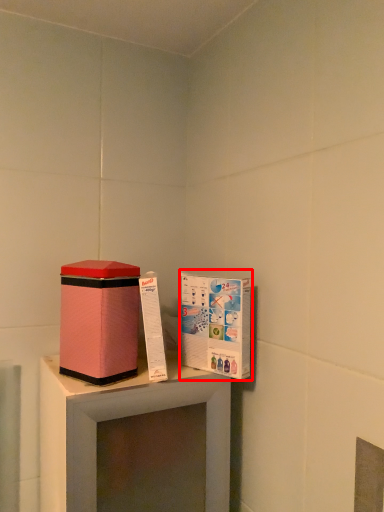
Question: From the image's perspective, what is the correct spatial relationship of cardboard box (annotated by the red box) in relation to box?

Choices:
 (A) below
 (B) above

Answer: (A)